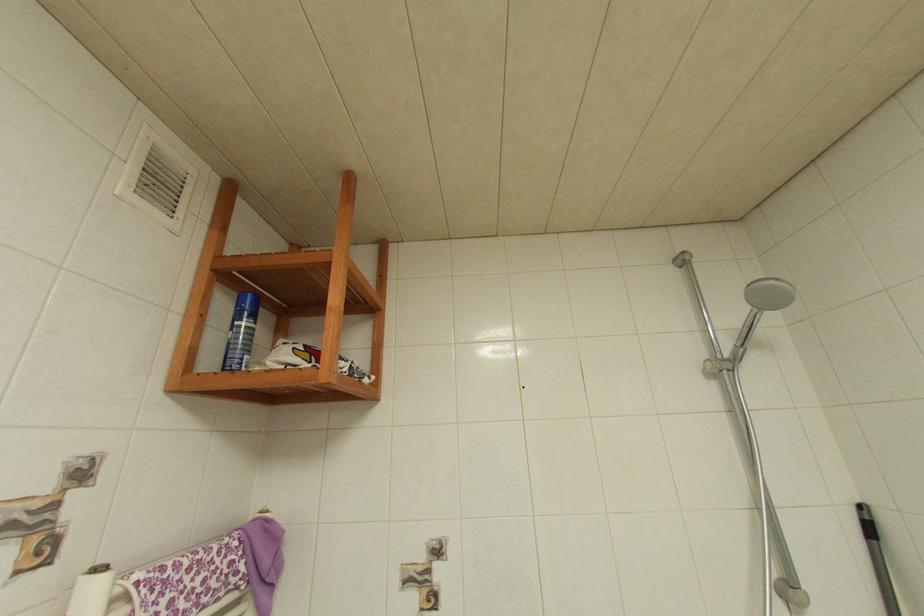
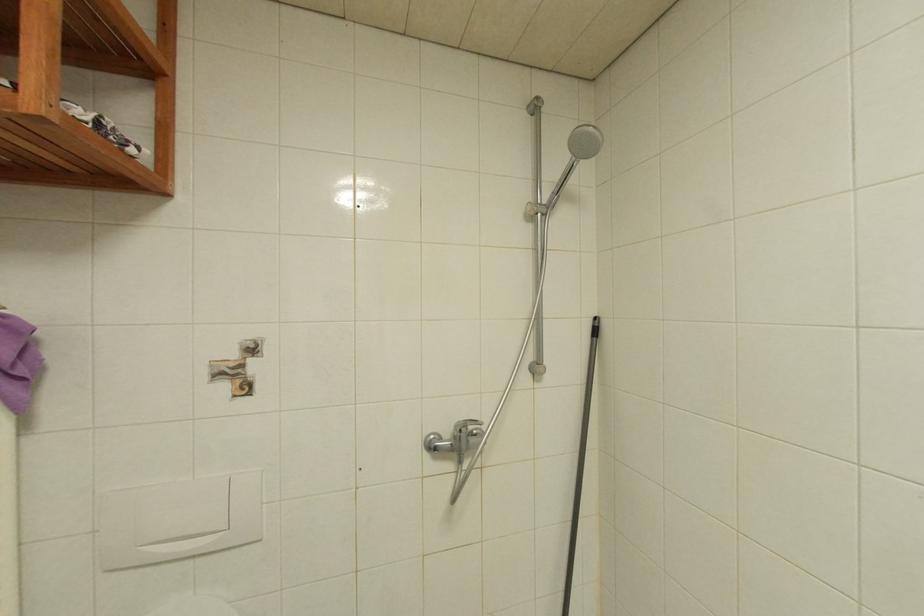
Question: The images are taken continuously from a first-person perspective. In which direction are you moving?

Choices:
 (A) Left
 (B) Right
 (C) Forward
 (D) Backward

Answer: (B)